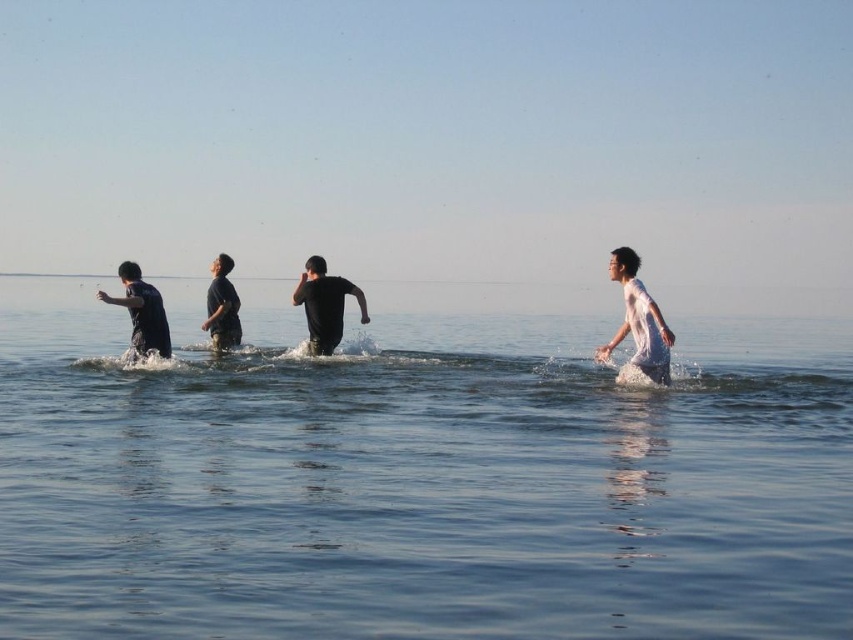
Question: Does black matte shirt at center have a larger size compared to dark blue fabric at center?

Choices:
 (A) no
 (B) yes

Answer: (B)

Question: Does black matte shirt at center have a lesser width compared to dark blue fabric at center?

Choices:
 (A) yes
 (B) no

Answer: (B)

Question: Which point is closer to the camera taking this photo?

Choices:
 (A) (618, 332)
 (B) (132, 268)

Answer: (B)

Question: Which object is positioned farthest from the white matte shirt at right?

Choices:
 (A) clear blue water at center
 (B) black matte shirt at center
 (C) matte black shirt at left
 (D) dark blue fabric at center

Answer: (A)

Question: Is white matte shirt at right positioned behind black matte shirt at center?

Choices:
 (A) yes
 (B) no

Answer: (B)

Question: Based on their relative distances, which object is nearer to the matte black shirt at left?

Choices:
 (A) white matte shirt at right
 (B) black matte shirt at center

Answer: (B)